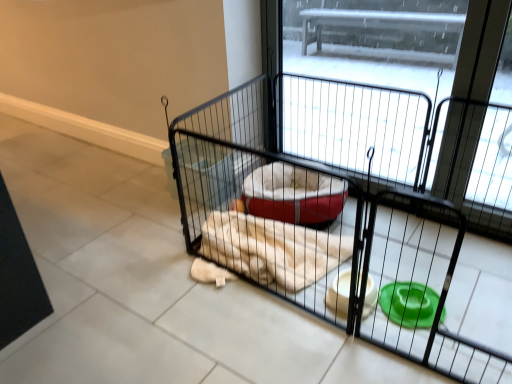
Question: From a real-world perspective, is black wire cage at center above or below black wire screen door at center?

Choices:
 (A) below
 (B) above

Answer: (A)

Question: Is black wire cage at center wider or thinner than black wire screen door at center?

Choices:
 (A) thin
 (B) wide

Answer: (B)

Question: Does point (455, 377) appear closer or farther from the camera than point (458, 127)?

Choices:
 (A) closer
 (B) farther

Answer: (A)

Question: In terms of size, does black wire screen door at center appear bigger or smaller than black wire cage at center?

Choices:
 (A) small
 (B) big

Answer: (A)

Question: From a real-world perspective, is black wire screen door at center physically located above or below black wire cage at center?

Choices:
 (A) above
 (B) below

Answer: (A)

Question: Considering the positions of black wire screen door at center and black wire cage at center in the image, is black wire screen door at center wider or thinner than black wire cage at center?

Choices:
 (A) wide
 (B) thin

Answer: (B)

Question: Is black wire screen door at center spatially inside black wire cage at center, or outside of it?

Choices:
 (A) outside
 (B) inside

Answer: (A)